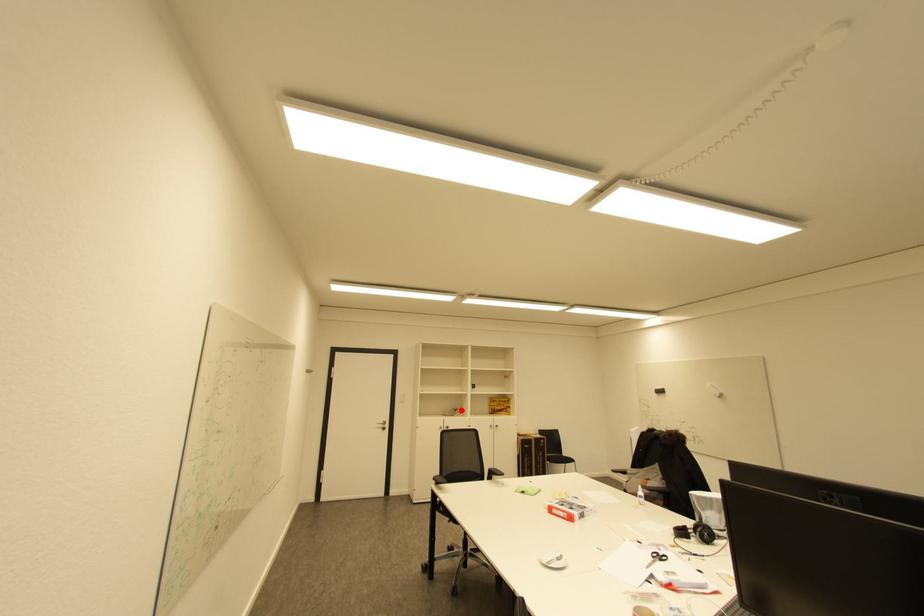
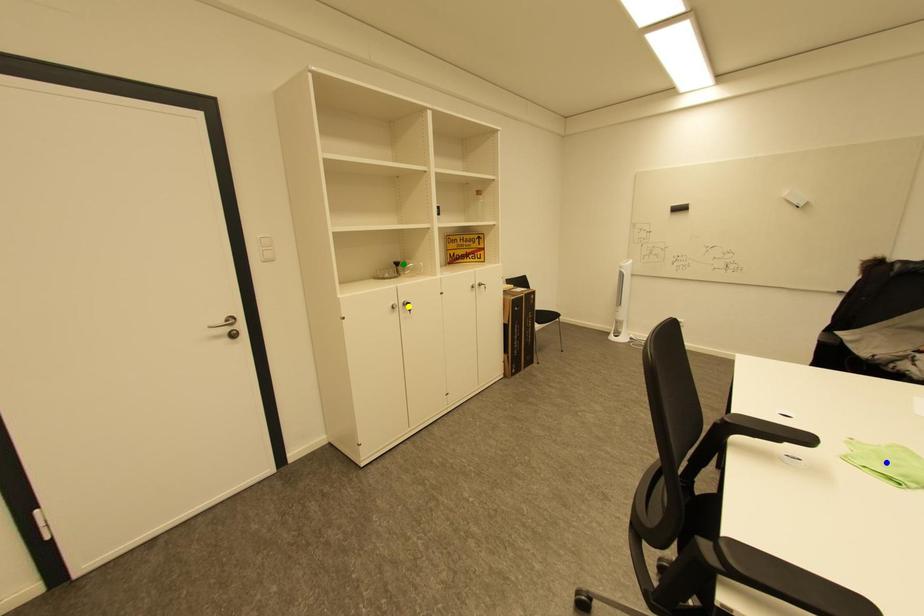
Question: I am providing you with two images of the same scene from different viewpoints. A red point is marked on the first image. You are given multiple points on the second image. Which point in image 2 represents the same 3d spot as the red point in image 1?

Choices:
 (A) yellow point
 (B) green point
 (C) blue point

Answer: (B)